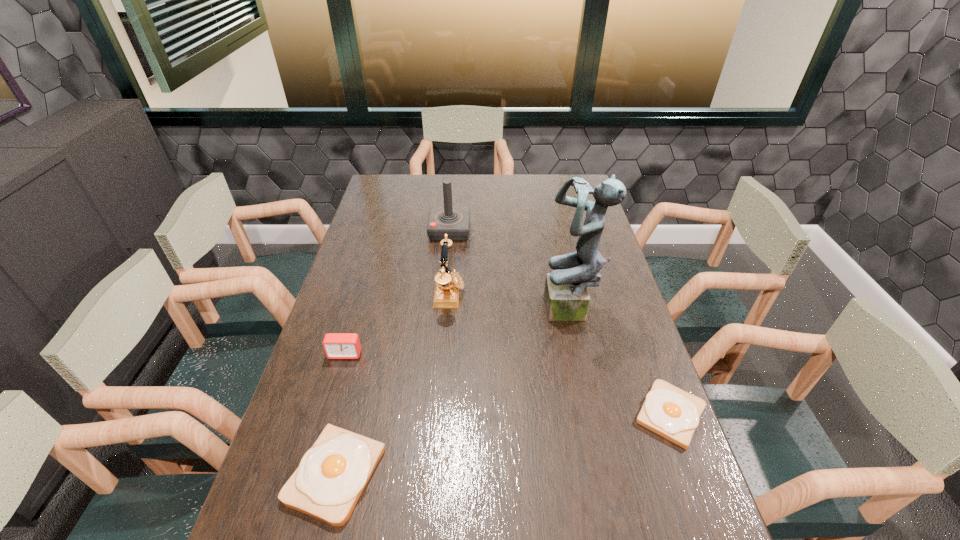
The height and width of the screenshot is (540, 960). Identify the location of the second shortest object. (332, 474).

Find the location of a particular element. This screenshot has height=540, width=960. the left toast is located at coordinates point(332,474).

Where is `the rightmost object`? This screenshot has height=540, width=960. the rightmost object is located at coordinates (668, 411).

Identify the location of the right toast. The width and height of the screenshot is (960, 540). (668, 411).

The width and height of the screenshot is (960, 540). In order to click on telephone in this screenshot , I will do `click(448, 283)`.

You are a GUI agent. You are given a task and a screenshot of the screen. Output one action in this format:
    pyautogui.click(x=<x>, y=<y>)
    Task: Click on the fourth tallest object
    This screenshot has width=960, height=540.
    Given the screenshot: What is the action you would take?
    pyautogui.click(x=336, y=345)

Find the location of `the third nearest object`. the third nearest object is located at coordinates (336, 345).

In order to click on joystick in this screenshot , I will do `click(454, 221)`.

The height and width of the screenshot is (540, 960). Find the location of `the second tallest object`. the second tallest object is located at coordinates (454, 221).

This screenshot has width=960, height=540. I want to click on the tallest object, so click(566, 296).